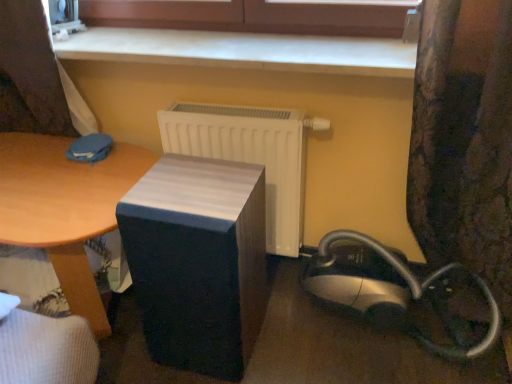
Locate an element on the screen. empty space that is ontop of smooth white surface at upper center (from a real-world perspective) is located at coordinates (224, 44).